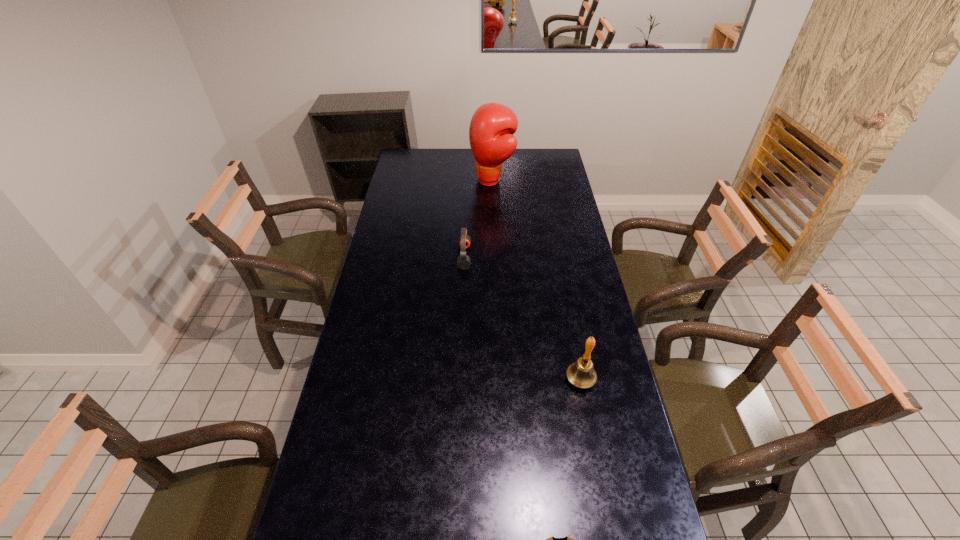
Identify the location of free point between the third farthest object and the second farthest object. (522, 318).

In order to click on vacant region between the third nearest object and the boxing glove in this screenshot , I will do `click(478, 219)`.

Where is `object that is the second closest one to the boxing glove`? The width and height of the screenshot is (960, 540). object that is the second closest one to the boxing glove is located at coordinates (581, 374).

Choose which object is the nearest neighbor to the shortest object. Please provide its 2D coordinates. Your answer should be formatted as a tuple, i.e. [(x, y)], where the tuple contains the x and y coordinates of a point satisfying the conditions above.

[(581, 374)]

The height and width of the screenshot is (540, 960). I want to click on vacant region that satisfies the following two spatial constraints: 1. on the striking surface of the boxing glove; 2. on the left side of the bell, so click(x=500, y=380).

The height and width of the screenshot is (540, 960). What are the coordinates of `vacant area in the image that satisfies the following two spatial constraints: 1. on the ear cups of the earphone; 2. on the back side of the bell` in the screenshot? It's located at (460, 380).

Image resolution: width=960 pixels, height=540 pixels. In order to click on free spot that satisfies the following two spatial constraints: 1. on the striking surface of the tallest object; 2. on the left side of the second nearest object in this screenshot , I will do `click(500, 380)`.

This screenshot has width=960, height=540. In order to click on blank space that satisfies the following two spatial constraints: 1. on the striking surface of the rightmost object; 2. on the right side of the farthest object in this screenshot , I will do `click(500, 380)`.